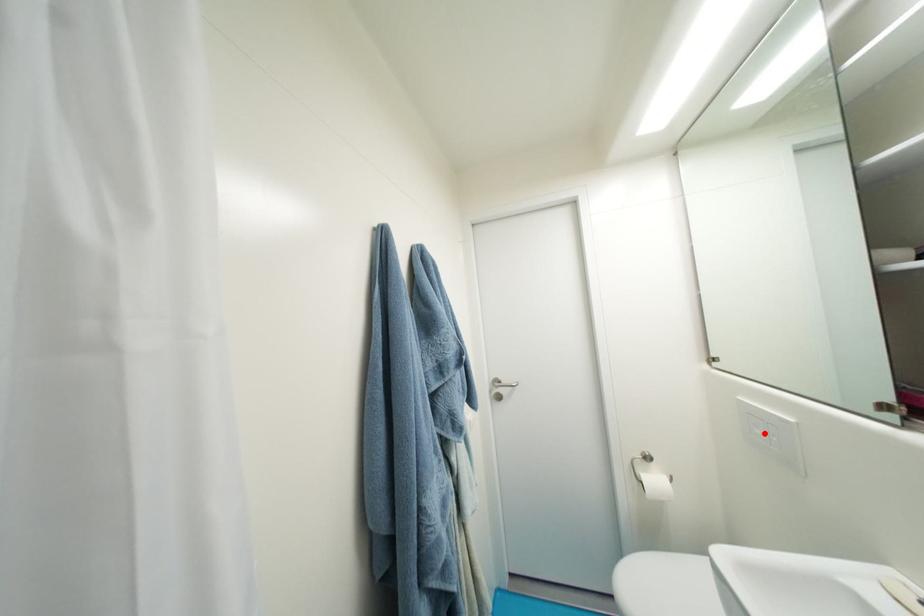
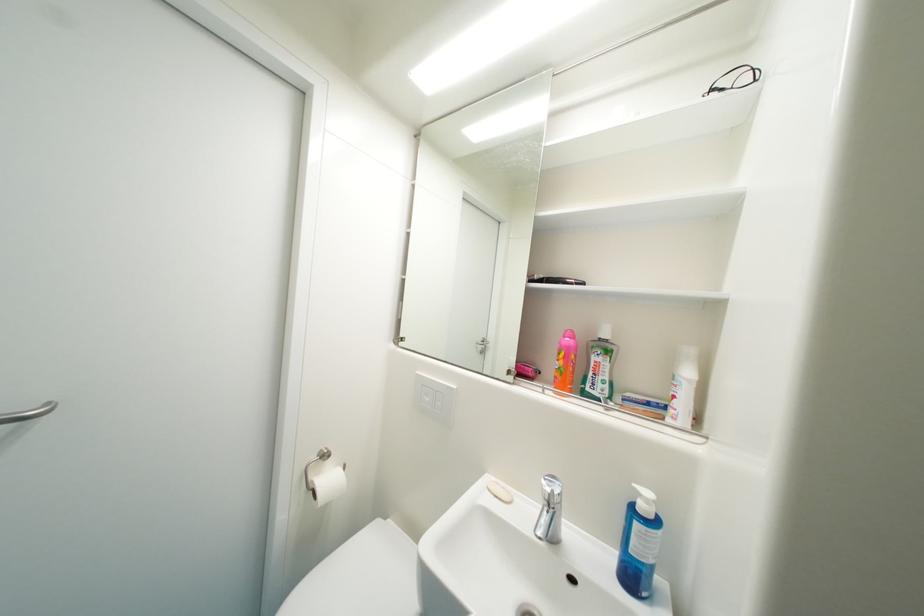
Locate, in the second image, the point that corresponds to the highlighted location in the first image.

(433, 400)